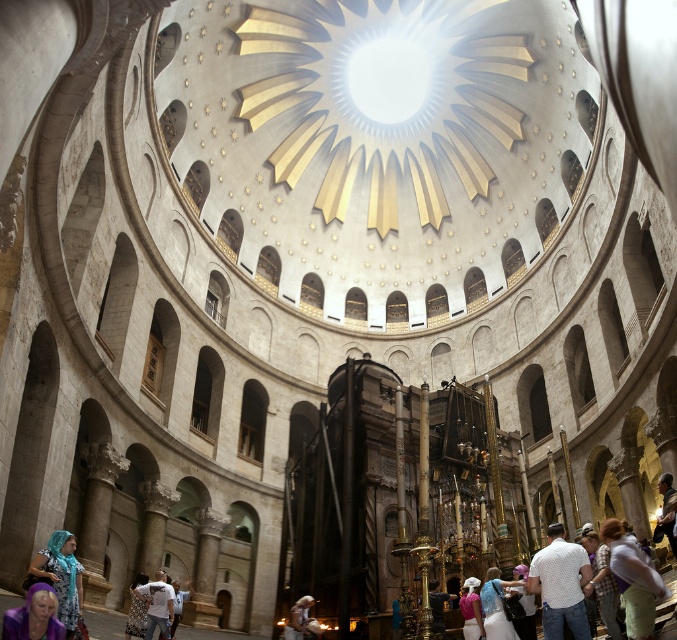
Between point (647, 634) and point (313, 618), which one is positioned in front?

Positioned in front is point (647, 634).

Does white fabric at center appear under light brown leather jacket at lower center?

Incorrect, white fabric at center is not positioned below light brown leather jacket at lower center.

Which is behind, point (621, 538) or point (307, 632)?

The point (307, 632) is more distant.

You are a GUI agent. You are given a task and a screenshot of the screen. Output one action in this format:
    pyautogui.click(x=<x>, y=<y>)
    Task: Click on the white fabric at center
    Image resolution: width=677 pixels, height=640 pixels.
    Given the screenshot: What is the action you would take?
    [x=633, y=579]

In the scene shown: Measure the distance from printed fabric headscarf at lower left to purple fabric at lower left.

printed fabric headscarf at lower left and purple fabric at lower left are 6.11 meters apart.

Which is above, printed fabric headscarf at lower left or purple fabric at lower left?

purple fabric at lower left is higher up.

Who is more distant from viewer, (70,589) or (18,620)?

Point (70,589)

Where is `printed fabric headscarf at lower left`? This screenshot has height=640, width=677. printed fabric headscarf at lower left is located at coordinates (62, 576).

Is point (502, 627) positioned before point (146, 586)?

Yes, it is.

Which is above, blue satin dress at lower center or white cotton shirt at lower center?

Positioned higher is blue satin dress at lower center.

Find the location of a particular element. blue satin dress at lower center is located at coordinates (496, 605).